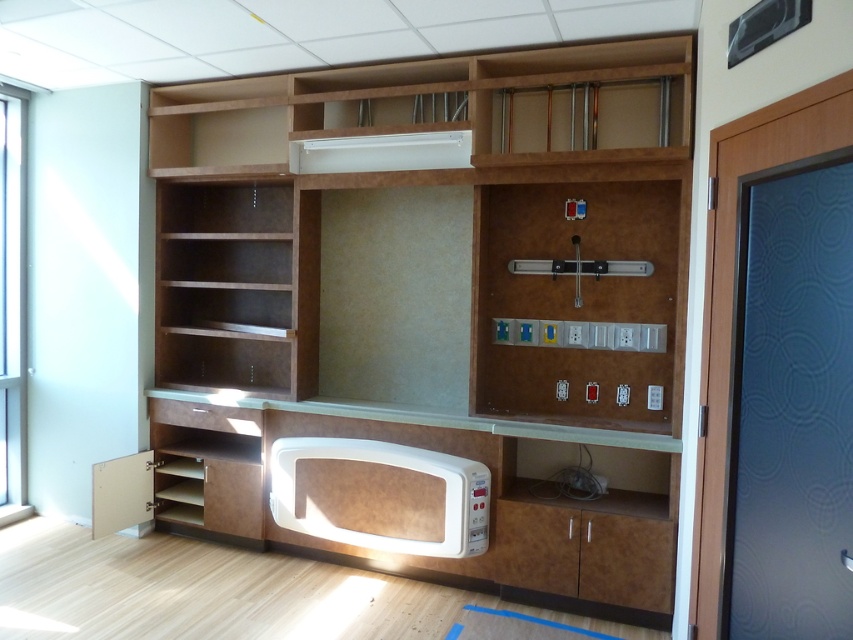
Which is behind, point (491, 490) or point (619, 310)?

Positioned behind is point (619, 310).

This screenshot has width=853, height=640. I want to click on burlwood cabinet at center, so click(x=440, y=307).

Who is lower down, wooden panel control panel at center or white matte microwave at lower center?

Positioned lower is white matte microwave at lower center.

Image resolution: width=853 pixels, height=640 pixels. What do you see at coordinates (582, 300) in the screenshot?
I see `wooden panel control panel at center` at bounding box center [582, 300].

Where is `wooden panel control panel at center`? This screenshot has height=640, width=853. wooden panel control panel at center is located at coordinates (582, 300).

Locate an element on the screen. This screenshot has width=853, height=640. burlwood cabinet at center is located at coordinates (440, 307).

Is burlwood cabinet at center shorter than white matte microwave at lower center?

No, burlwood cabinet at center is not shorter than white matte microwave at lower center.

The width and height of the screenshot is (853, 640). Find the location of `burlwood cabinet at center`. burlwood cabinet at center is located at coordinates (440, 307).